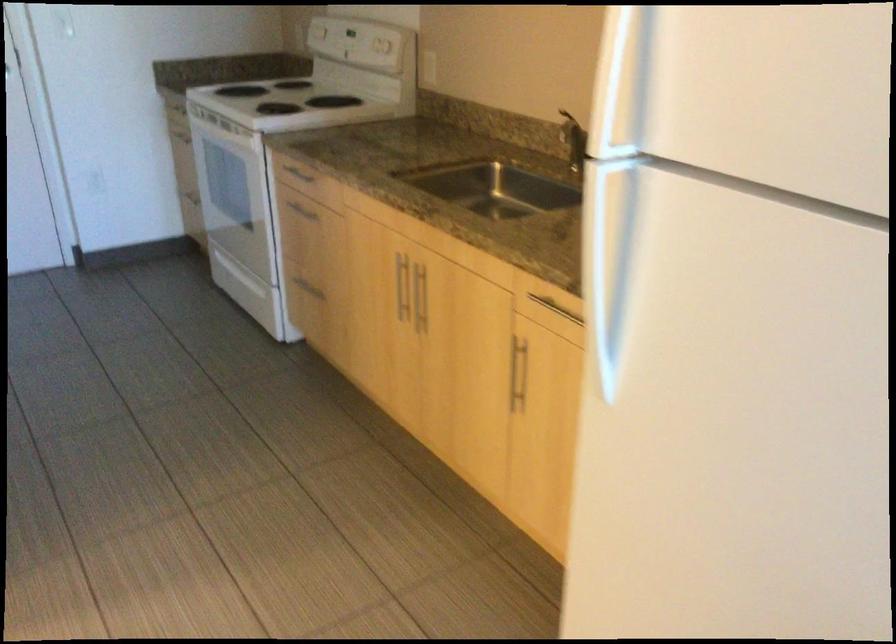
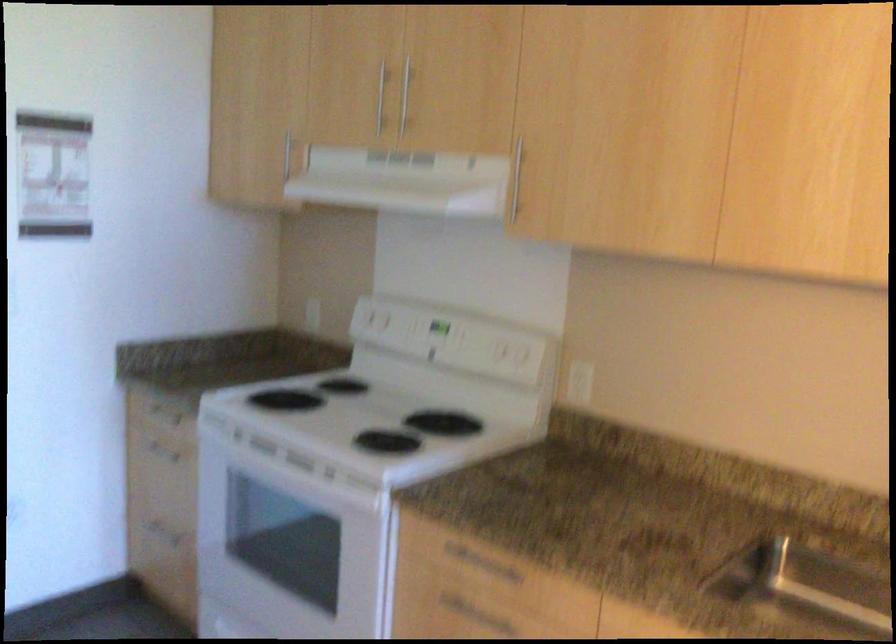
Locate, in the second image, the point that corresponds to point 298,178 in the first image.

(480, 564)